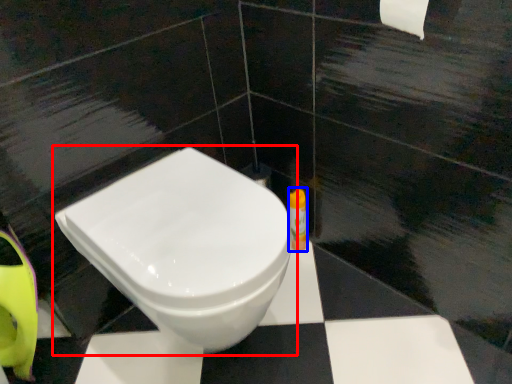
Question: Which point is closer to the camera, toilet (highlighted by a red box) or toiletry (highlighted by a blue box)?

Choices:
 (A) toilet
 (B) toiletry

Answer: (A)